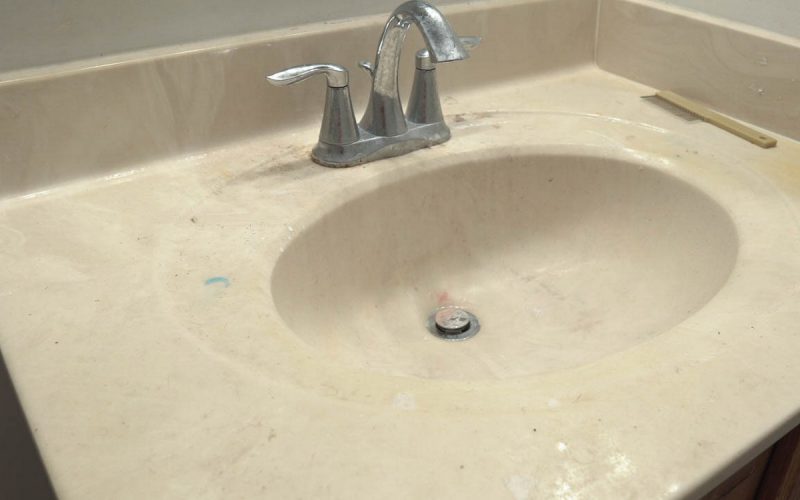
The width and height of the screenshot is (800, 500). Identify the location of faucet handle. (330, 81), (426, 58).